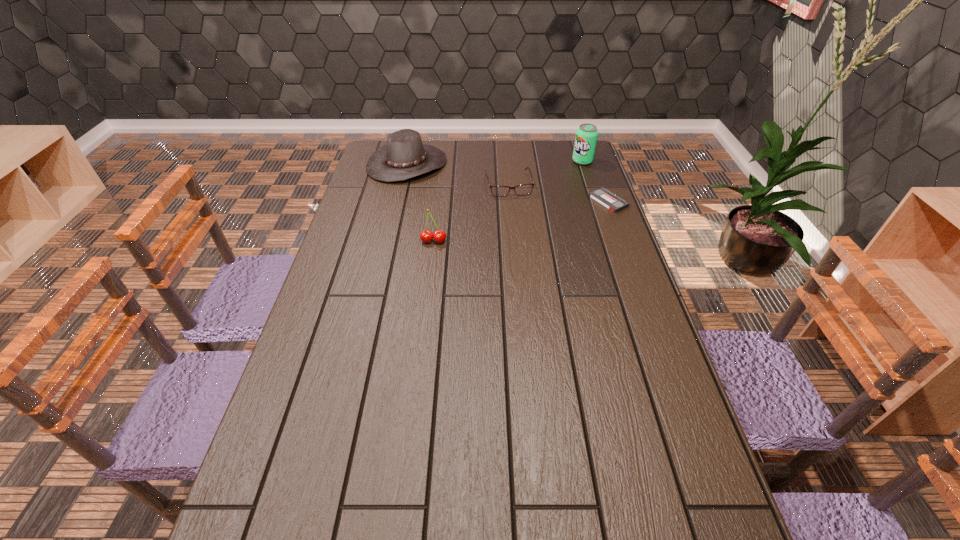
Locate an element on the screen. vacant space on the desktop that is between the cherry and the shortest object and is positioned on the front-facing side of the pop soda is located at coordinates click(x=509, y=224).

This screenshot has width=960, height=540. Identify the location of vacant space on the desktop that is between the cherry and the shortest object and is positioned on the lenses of the third object from right to left. [519, 221].

In order to click on vacant space on the desktop that is between the nearest object and the videotape and is positioned on the front-facing side of the hat in this screenshot , I will do `click(499, 226)`.